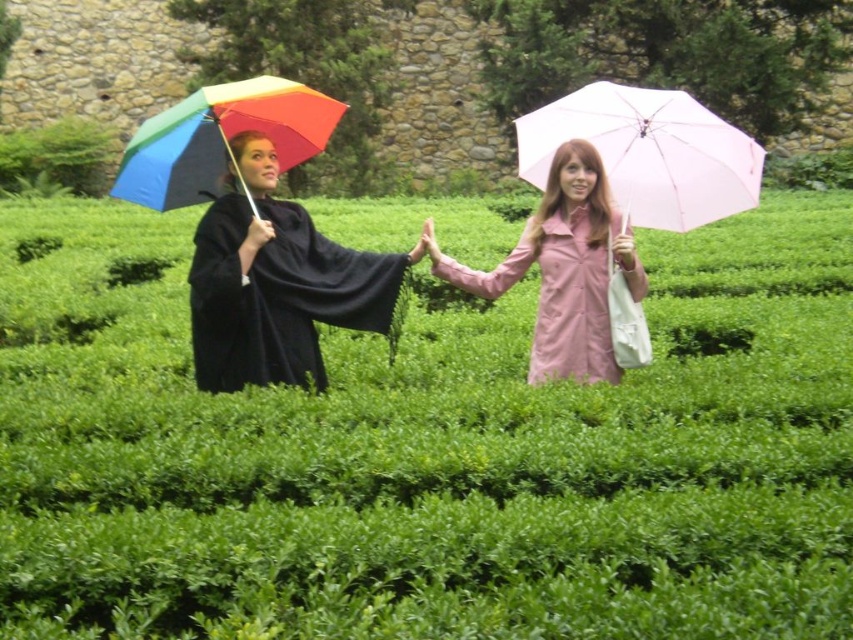
Question: Can you confirm if pink matte umbrella at center is bigger than pink matte trench coat at center?

Choices:
 (A) yes
 (B) no

Answer: (A)

Question: Considering the relative positions of matte black cape at left and pink matte umbrella at center in the image provided, where is matte black cape at left located with respect to pink matte umbrella at center?

Choices:
 (A) right
 (B) left

Answer: (B)

Question: Which object is positioned closest to the pink matte umbrella at center?

Choices:
 (A) rainbow fabric umbrella at left
 (B) black matte cape at left
 (C) matte black cape at left
 (D) green leafy hedge at left

Answer: (C)

Question: Is pink matte trench coat at center wider than rainbow fabric umbrella at left?

Choices:
 (A) yes
 (B) no

Answer: (B)

Question: Which is nearer to the pink matte umbrella at center?

Choices:
 (A) rainbow fabric umbrella at left
 (B) pink matte trench coat at center

Answer: (B)

Question: Which point is farther to the camera?

Choices:
 (A) (340, 106)
 (B) (664, 90)

Answer: (B)